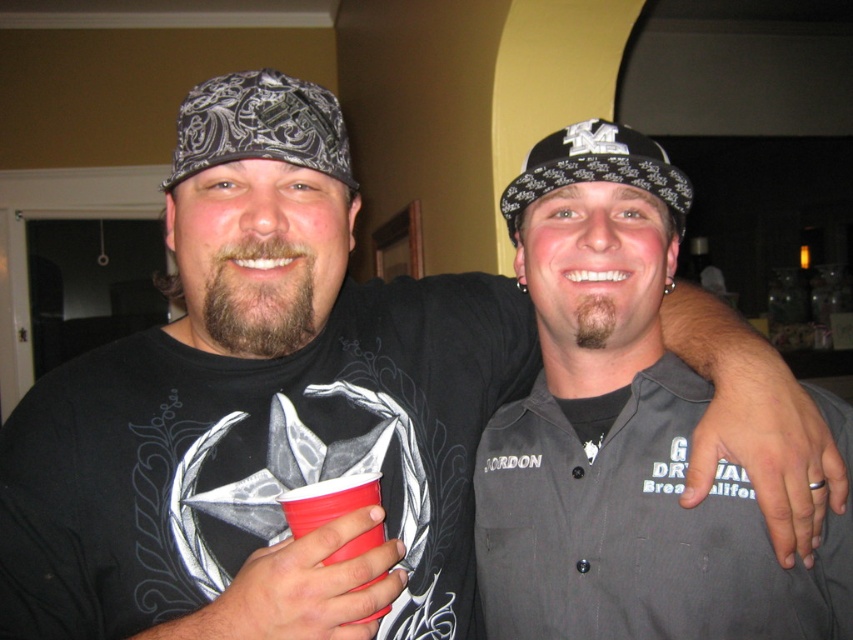
Question: Estimate the real-world distances between objects in this image. Which object is closer to the black printed bandana at upper left?

Choices:
 (A) rubberized plastic cup at lower left
 (B) black bandana at center

Answer: (B)

Question: Is black printed bandana at upper left above rubberized plastic cup at lower left?

Choices:
 (A) no
 (B) yes

Answer: (B)

Question: Which point is farther to the camera?

Choices:
 (A) black printed bandana at upper left
 (B) gray button-up shirt at center

Answer: (B)

Question: Estimate the real-world distances between objects in this image. Which object is farther from the rubberized plastic cup at lower left?

Choices:
 (A) gray button-up shirt at center
 (B) black bandana at center
 (C) black printed bandana at upper left

Answer: (B)

Question: Can you confirm if black bandana at center is positioned below rubberized plastic cup at lower left?

Choices:
 (A) yes
 (B) no

Answer: (B)

Question: Is black printed bandana at upper left positioned before black bandana at center?

Choices:
 (A) no
 (B) yes

Answer: (B)